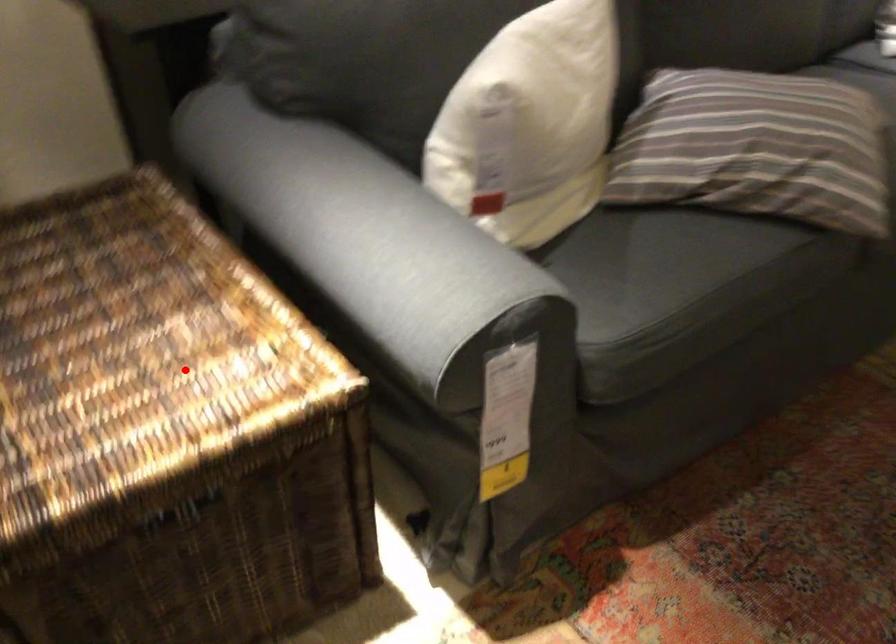
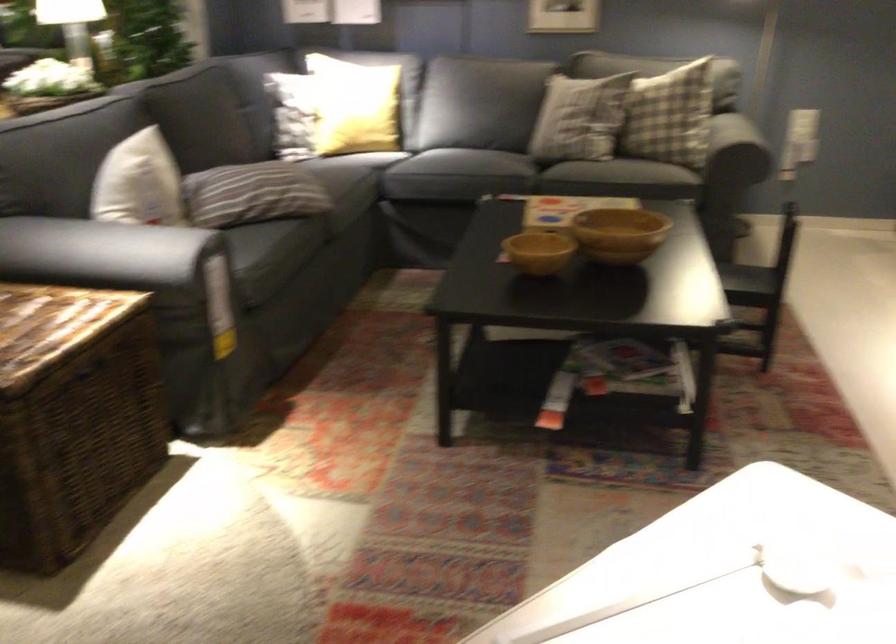
Find the pixel in the second image that matches the highlighted location in the first image.

(55, 317)